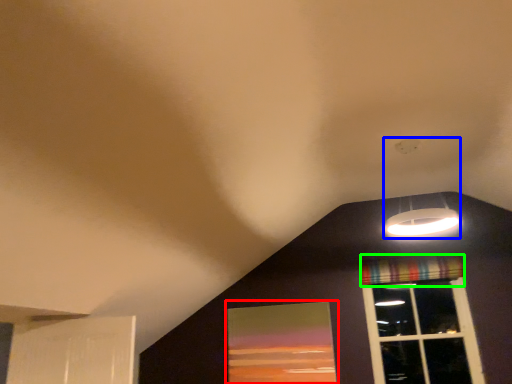
Question: Based on their relative distances, which object is nearer to window screen (highlighted by a red box)? Choose from lamp (highlighted by a blue box) and curtain (highlighted by a green box).

Choices:
 (A) lamp
 (B) curtain

Answer: (B)